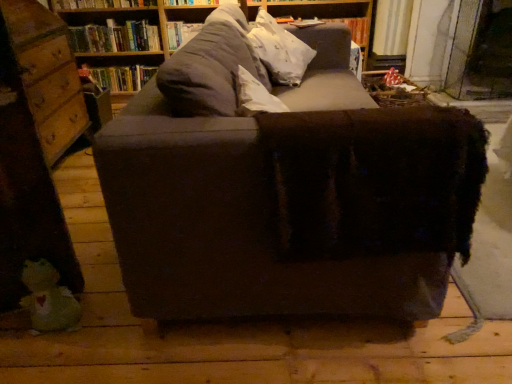
In order to click on spots to the right of green plush toy at lower left in this screenshot , I will do `click(91, 335)`.